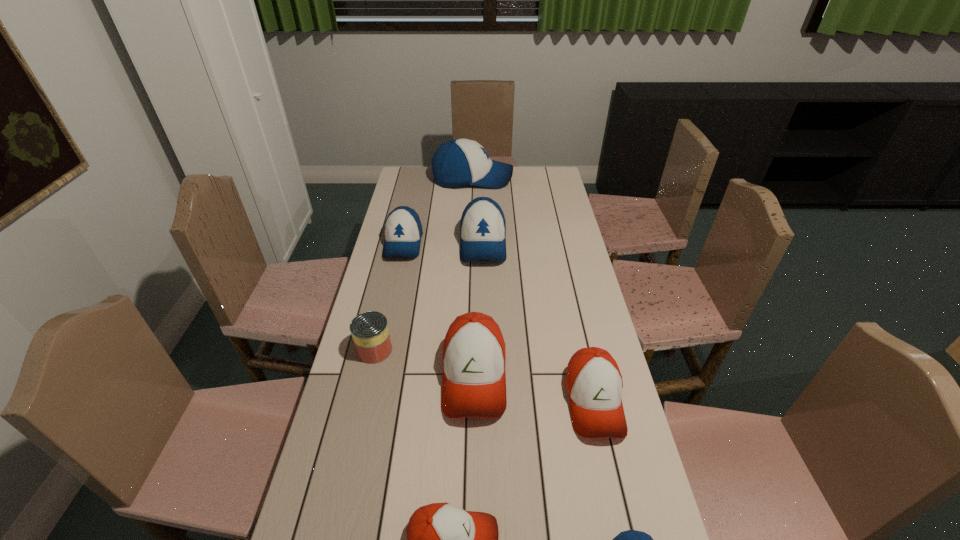
Identify the location of the sixth closest baseball cap to the can. (631, 539).

Identify which baseball cap is the third nearest to the biggest orange baseball cap. Please provide its 2D coordinates. Your answer should be formatted as a tuple, i.e. [(x, y)], where the tuple contains the x and y coordinates of a point satisfying the conditions above.

[(482, 226)]

This screenshot has height=540, width=960. In order to click on blue baseball cap identified as the second closest to the smallest blue baseball cap in this screenshot , I will do `click(403, 230)`.

Where is `blue baseball cap object that ranks as the closest to the farthest blue baseball cap`? The image size is (960, 540). blue baseball cap object that ranks as the closest to the farthest blue baseball cap is located at coordinates (482, 226).

Identify which orange baseball cap is the second nearest to the second smallest blue baseball cap. Please provide its 2D coordinates. Your answer should be formatted as a tuple, i.e. [(x, y)], where the tuple contains the x and y coordinates of a point satisfying the conditions above.

[(594, 384)]

Choose which orange baseball cap is the nearest neighbor to the farthest blue baseball cap. Please provide its 2D coordinates. Your answer should be formatted as a tuple, i.e. [(x, y)], where the tuple contains the x and y coordinates of a point satisfying the conditions above.

[(474, 380)]

The width and height of the screenshot is (960, 540). I want to click on free space that satisfies the following two spatial constraints: 1. on the front-facing side of the biggest blue baseball cap; 2. on the front-facing side of the second smallest blue baseball cap, so click(470, 243).